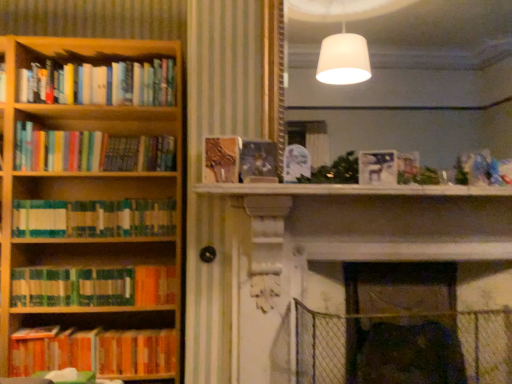
Question: Considering their positions, is green matte bookshelf at left, which is the 4th book in top-to-bottom order, located in front of or behind orange matte bookshelf at lower left, the first book in the bottom-to-top sequence?

Choices:
 (A) behind
 (B) front

Answer: (A)

Question: From the image's perspective, is green matte bookshelf at left, which is the 4th book in top-to-bottom order, located above or below orange matte bookshelf at lower left, the first book in the bottom-to-top sequence?

Choices:
 (A) below
 (B) above

Answer: (B)

Question: Which object is the farthest from the velvet dark brown swivel chair at lower right?

Choices:
 (A) green matte bookshelf at left, positioned as the 5th book in top-to-bottom order
 (B) orange matte bookshelf at lower left, the first book in the bottom-to-top sequence
 (C) green matte bookshelf at left, the 3th book ordered from the bottom
 (D) white matte paper at upper center
 (E) wooden bookcase at left

Answer: (E)

Question: Estimate the real-world distances between objects in this image. Which object is farther from the velvet dark brown swivel chair at lower right?

Choices:
 (A) green matte bookshelf at left, the 2th book ordered from the bottom
 (B) hardcover books at left, which ranks as the 6th book in bottom-to-top order
 (C) orange matte bookshelf at lower left, the 6th book in the top-to-bottom sequence
 (D) multicolored paperbacks at left, which appears as the fifth book when ordered from the bottom
 (E) shiny metallic book at center, the 4th book from the bottom

Answer: (B)